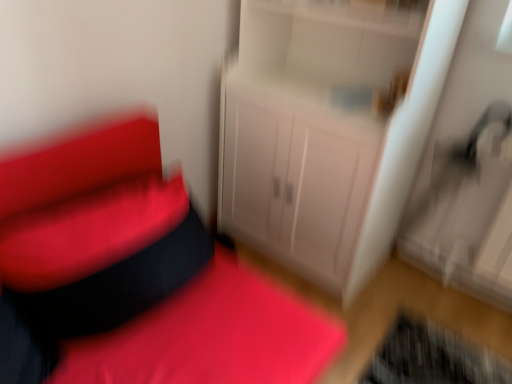
Question: Would you say matte white cabinet at center is outside white glossy cabinet at center?

Choices:
 (A) no
 (B) yes

Answer: (B)

Question: Does matte white cabinet at center contain white glossy cabinet at center?

Choices:
 (A) no
 (B) yes

Answer: (A)

Question: From the image's perspective, does matte white cabinet at center appear higher than white glossy cabinet at center?

Choices:
 (A) yes
 (B) no

Answer: (B)

Question: Is the position of matte white cabinet at center more distant than that of white glossy cabinet at center?

Choices:
 (A) yes
 (B) no

Answer: (B)

Question: Is the depth of matte white cabinet at center less than that of white glossy cabinet at center?

Choices:
 (A) yes
 (B) no

Answer: (A)

Question: Can you confirm if matte white cabinet at center is positioned to the left of white glossy cabinet at center?

Choices:
 (A) yes
 (B) no

Answer: (A)

Question: Considering the relative positions of white glossy cabinet at center and metallic silver swivel chair at right in the image provided, is white glossy cabinet at center to the left of metallic silver swivel chair at right from the viewer's perspective?

Choices:
 (A) yes
 (B) no

Answer: (A)

Question: Is white glossy cabinet at center looking in the opposite direction of metallic silver swivel chair at right?

Choices:
 (A) no
 (B) yes

Answer: (A)

Question: From the image's perspective, is white glossy cabinet at center beneath metallic silver swivel chair at right?

Choices:
 (A) no
 (B) yes

Answer: (A)

Question: Could you tell me if white glossy cabinet at center is facing metallic silver swivel chair at right?

Choices:
 (A) yes
 (B) no

Answer: (B)

Question: From a real-world perspective, is white glossy cabinet at center located higher than metallic silver swivel chair at right?

Choices:
 (A) yes
 (B) no

Answer: (A)

Question: Is white glossy cabinet at center located outside metallic silver swivel chair at right?

Choices:
 (A) yes
 (B) no

Answer: (A)

Question: Is metallic silver swivel chair at right located outside matte white cabinet at center?

Choices:
 (A) yes
 (B) no

Answer: (A)